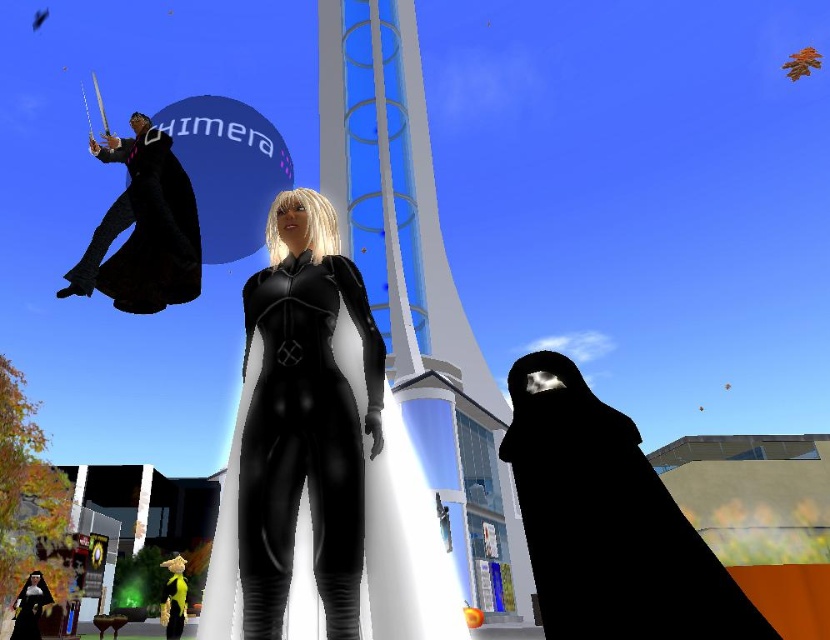
Question: Which point is farther to the camera?

Choices:
 (A) matte black bodysuit at center
 (B) matte black robe at upper left

Answer: (B)

Question: Is matte black bodysuit at center wider than matte black robe at upper left?

Choices:
 (A) yes
 (B) no

Answer: (B)

Question: Does matte black bodysuit at center have a lesser width compared to matte black robe at upper left?

Choices:
 (A) yes
 (B) no

Answer: (A)

Question: Is the position of matte black bodysuit at center more distant than that of matte black robe at upper left?

Choices:
 (A) yes
 (B) no

Answer: (B)

Question: Which point is farther to the camera?

Choices:
 (A) matte black bodysuit at center
 (B) matte black robe at upper left

Answer: (B)